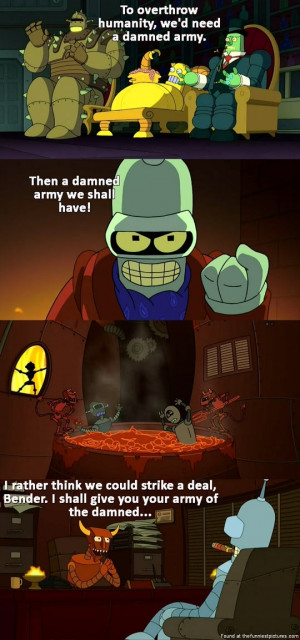
The width and height of the screenshot is (300, 640). In order to click on window blinds in this screenshot , I will do `click(286, 506)`, `click(206, 518)`.